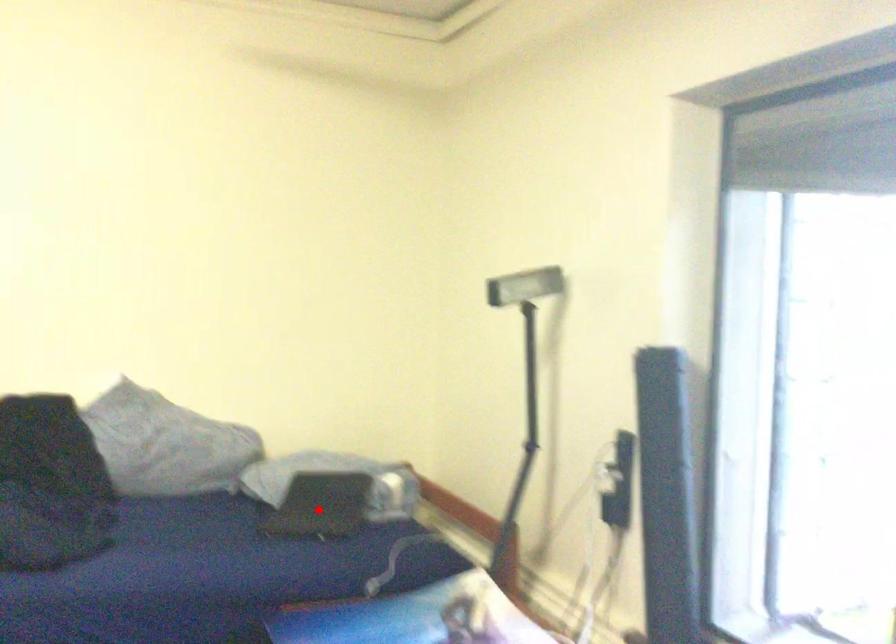
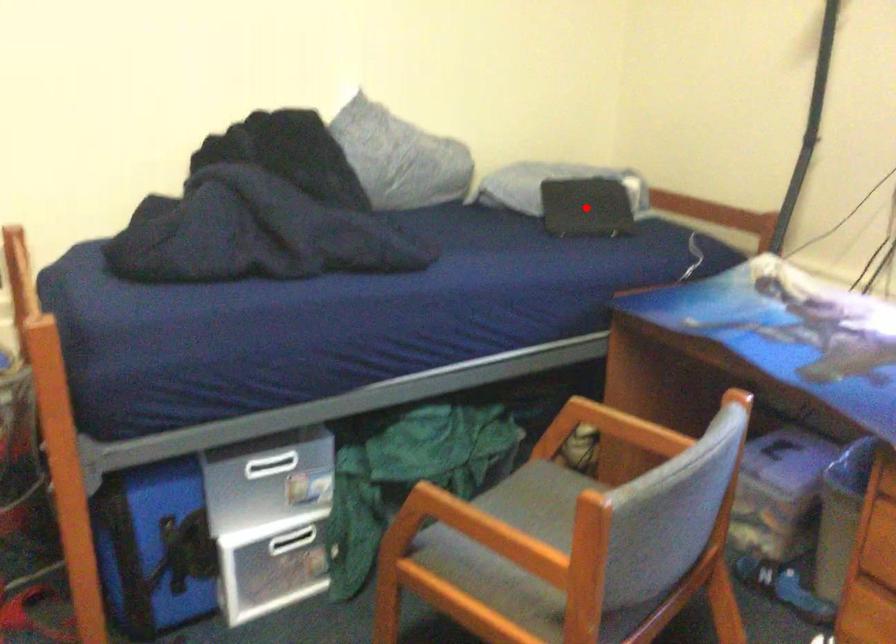
I am providing you with two images of the same scene from different viewpoints. A red point is marked on the first image and another point is marked on the second image. Do the highlighted points in image1 and image2 indicate the same real-world spot?

Yes